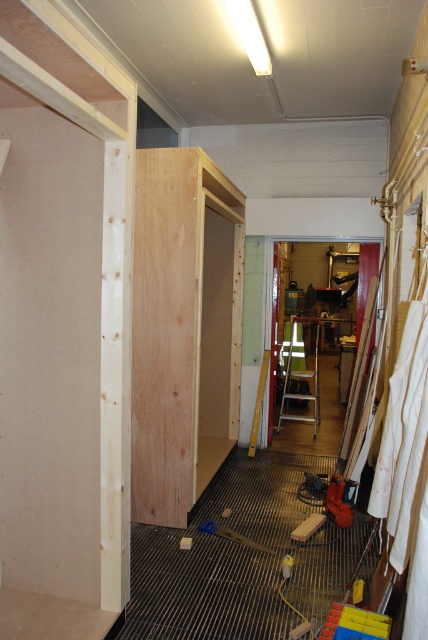
Is natural wood panel at center wider than wooden step ladder at center?

Incorrect, natural wood panel at center's width does not surpass wooden step ladder at center's.

Does natural wood panel at center have a greater height compared to wooden step ladder at center?

Yes.

Which is in front, point (184, 164) or point (284, 380)?

Positioned in front is point (184, 164).

Identify the location of natural wood panel at center. (166, 332).

Which is behind, point (299, 388) or point (241, 541)?

Point (299, 388)

Can you confirm if wooden step ladder at center is smaller than wooden plank at center?

Incorrect, wooden step ladder at center is not smaller in size than wooden plank at center.

Does point (285, 396) lie behind point (265, 552)?

That is True.

Locate an element on the screen. Image resolution: width=428 pixels, height=640 pixels. wooden step ladder at center is located at coordinates (300, 372).

Which is more to the left, natural wood panel at center or wooden plank at center?

From the viewer's perspective, natural wood panel at center appears more on the left side.

What are the coordinates of `natural wood panel at center` in the screenshot? It's located at (166, 332).